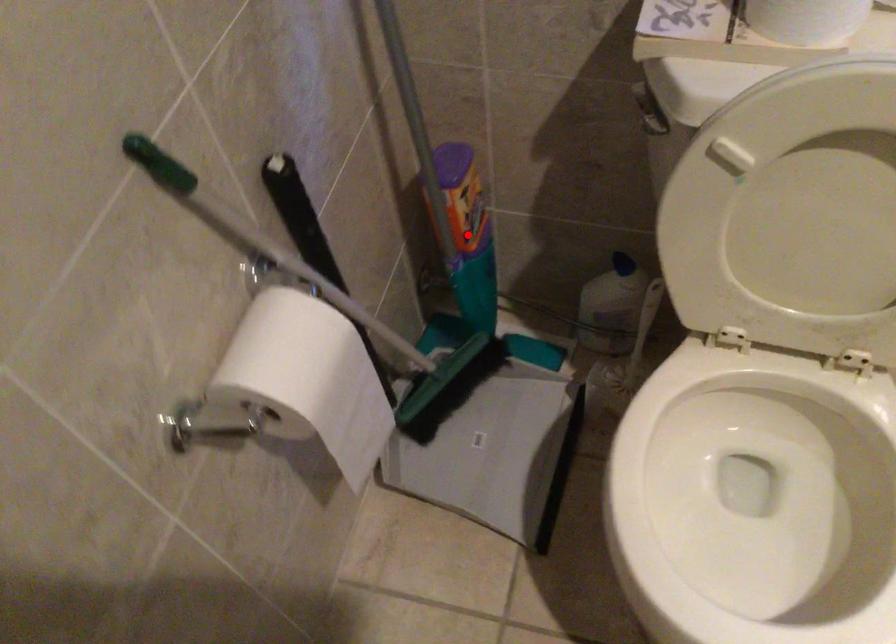
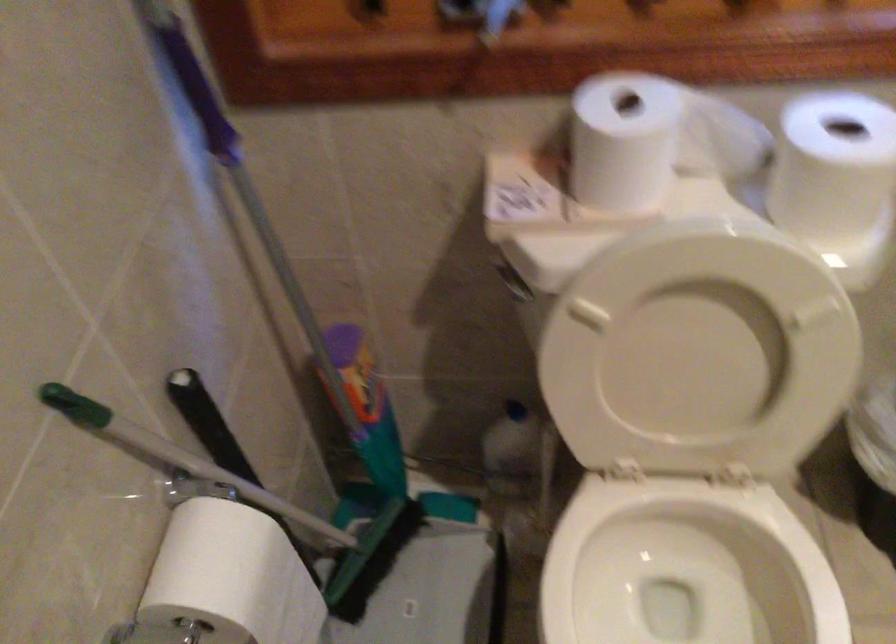
Locate, in the second image, the point that corresponds to the highlighted location in the first image.

(367, 408)